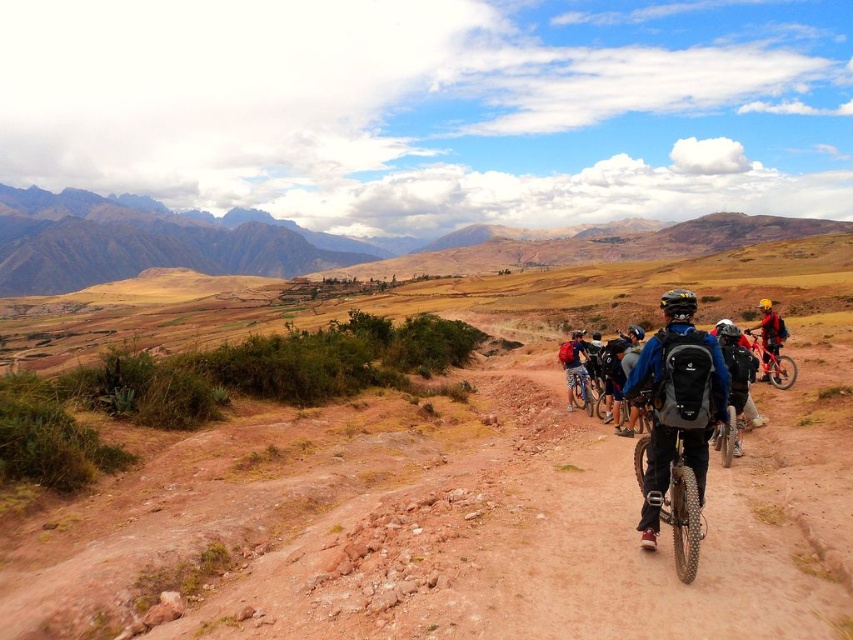
You are a hiker planning to take a photo of the rugged brown mountains at upper left and the matte black backpack at center. Which object should you focus on first if you want to capture both in a single frame without moving the camera?

The rugged brown mountains at upper left should be focused on first because they are larger in size compared to the matte black backpack at center, making them the primary subject for the frame.